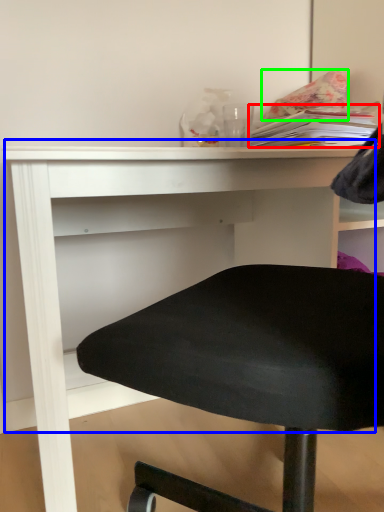
Question: Which is nearer to the book (highlighted by a red box)? table (highlighted by a blue box) or pillow (highlighted by a green box).

Choices:
 (A) table
 (B) pillow

Answer: (B)